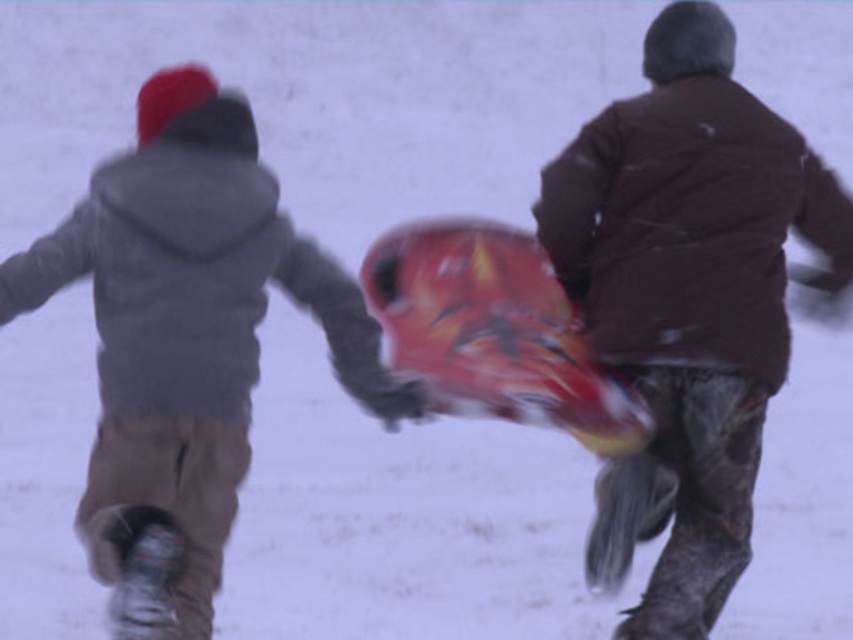
Question: Which point is closer to the camera?

Choices:
 (A) matte gray hoodie at left
 (B) brown matte jacket at center
 (C) shiny plastic snowboard at center

Answer: (A)

Question: Which object is closer to the camera taking this photo?

Choices:
 (A) brown matte jacket at center
 (B) shiny plastic snowboard at center
 (C) matte gray hoodie at left

Answer: (C)

Question: Considering the relative positions of matte gray hoodie at left and shiny plastic snowboard at center in the image provided, where is matte gray hoodie at left located with respect to shiny plastic snowboard at center?

Choices:
 (A) left
 (B) right

Answer: (A)

Question: Does matte gray hoodie at left have a lesser width compared to shiny plastic snowboard at center?

Choices:
 (A) no
 (B) yes

Answer: (A)

Question: Considering the relative positions of brown matte jacket at center and matte gray hoodie at left in the image provided, where is brown matte jacket at center located with respect to matte gray hoodie at left?

Choices:
 (A) right
 (B) left

Answer: (A)

Question: Which point is closer to the camera?

Choices:
 (A) shiny plastic snowboard at center
 (B) matte gray hoodie at left
 (C) brown matte jacket at center

Answer: (B)